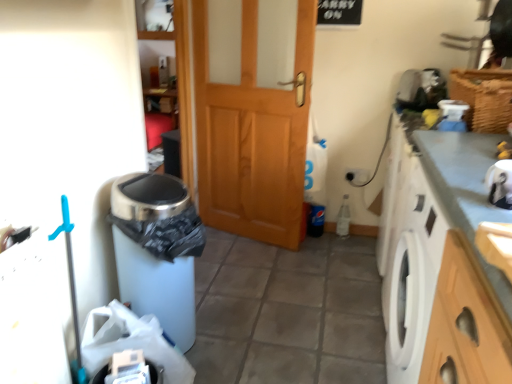
Locate an element on the screen. This screenshot has width=512, height=384. free spot to the right of wooden door at center is located at coordinates (336, 252).